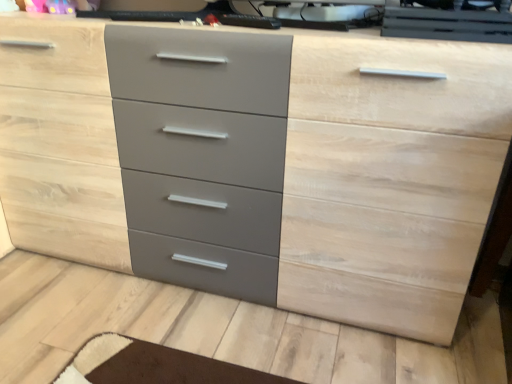
Describe the element at coordinates (446, 24) in the screenshot. The image size is (512, 384). I see `glossy black desktop computer at upper center, which is counted as the second desktop computer, starting from the left` at that location.

Measure the distance between glossy black desktop computer at upper center, the 1th desktop computer from the right, and camera.

34.69 inches.

Find the location of `glossy black desktop computer at upper center, which is counted as the second desktop computer, starting from the left`. glossy black desktop computer at upper center, which is counted as the second desktop computer, starting from the left is located at coordinates (446, 24).

What do you see at coordinates (325, 15) in the screenshot? This screenshot has width=512, height=384. I see `matte black desktop computer at upper center, the 1th desktop computer from the left` at bounding box center [325, 15].

Locate an element on the screen. Image resolution: width=512 pixels, height=384 pixels. matte black desktop computer at upper center, which is counted as the second desktop computer, starting from the right is located at coordinates (325, 15).

Where is `glossy black desktop computer at upper center, the 1th desktop computer from the right`? glossy black desktop computer at upper center, the 1th desktop computer from the right is located at coordinates (446, 24).

Is glossy black desktop computer at upper center, the 1th desktop computer from the right, to the right of matte black desktop computer at upper center, the 1th desktop computer from the left, from the viewer's perspective?

Correct, you'll find glossy black desktop computer at upper center, the 1th desktop computer from the right, to the right of matte black desktop computer at upper center, the 1th desktop computer from the left.

Is the position of glossy black desktop computer at upper center, which is counted as the second desktop computer, starting from the left, less distant than that of matte black desktop computer at upper center, which is counted as the second desktop computer, starting from the right?

Yes, glossy black desktop computer at upper center, which is counted as the second desktop computer, starting from the left, is closer to the camera.

Does point (386, 24) lie behind point (306, 19)?

No.

From the image's perspective, is glossy black desktop computer at upper center, the 1th desktop computer from the right, below matte black desktop computer at upper center, the 1th desktop computer from the left?

Yes, from the image's perspective, glossy black desktop computer at upper center, the 1th desktop computer from the right, is below matte black desktop computer at upper center, the 1th desktop computer from the left.

From a real-world perspective, is glossy black desktop computer at upper center, the 1th desktop computer from the right, under matte black desktop computer at upper center, which is counted as the second desktop computer, starting from the right?

Incorrect, from a real-world perspective, glossy black desktop computer at upper center, the 1th desktop computer from the right, is higher than matte black desktop computer at upper center, which is counted as the second desktop computer, starting from the right.

Can you confirm if glossy black desktop computer at upper center, which is counted as the second desktop computer, starting from the left, is wider than matte black desktop computer at upper center, which is counted as the second desktop computer, starting from the right?

Yes.

Considering the sizes of objects glossy black desktop computer at upper center, the 1th desktop computer from the right, and matte black desktop computer at upper center, which is counted as the second desktop computer, starting from the right, in the image provided, who is shorter, glossy black desktop computer at upper center, the 1th desktop computer from the right, or matte black desktop computer at upper center, which is counted as the second desktop computer, starting from the right,?

With less height is matte black desktop computer at upper center, which is counted as the second desktop computer, starting from the right.

From the picture: Which of these two, glossy black desktop computer at upper center, which is counted as the second desktop computer, starting from the left, or matte black desktop computer at upper center, which is counted as the second desktop computer, starting from the right, is smaller?

matte black desktop computer at upper center, which is counted as the second desktop computer, starting from the right, is smaller.

Is matte black desktop computer at upper center, which is counted as the second desktop computer, starting from the right, located within glossy black desktop computer at upper center, which is counted as the second desktop computer, starting from the left?

No, matte black desktop computer at upper center, which is counted as the second desktop computer, starting from the right, is not a part of glossy black desktop computer at upper center, which is counted as the second desktop computer, starting from the left.

Are glossy black desktop computer at upper center, the 1th desktop computer from the right, and matte black desktop computer at upper center, the 1th desktop computer from the left, far apart?

No, glossy black desktop computer at upper center, the 1th desktop computer from the right, is not far away from matte black desktop computer at upper center, the 1th desktop computer from the left.

Is glossy black desktop computer at upper center, the 1th desktop computer from the right, looking in the opposite direction of matte black desktop computer at upper center, which is counted as the second desktop computer, starting from the right?

glossy black desktop computer at upper center, the 1th desktop computer from the right, does not have its back to matte black desktop computer at upper center, which is counted as the second desktop computer, starting from the right.

Measure the distance from glossy black desktop computer at upper center, which is counted as the second desktop computer, starting from the left, to matte black desktop computer at upper center, which is counted as the second desktop computer, starting from the right.

They are 5.85 inches apart.

Locate an element on the screen. The width and height of the screenshot is (512, 384). desktop computer in front of the matte black desktop computer at upper center, which is counted as the second desktop computer, starting from the right is located at coordinates (446, 24).

Considering the positions of objects matte black desktop computer at upper center, the 1th desktop computer from the left, and glossy black desktop computer at upper center, the 1th desktop computer from the right, in the image provided, who is more to the right, matte black desktop computer at upper center, the 1th desktop computer from the left, or glossy black desktop computer at upper center, the 1th desktop computer from the right,?

From the viewer's perspective, glossy black desktop computer at upper center, the 1th desktop computer from the right, appears more on the right side.

In the image, is matte black desktop computer at upper center, the 1th desktop computer from the left, positioned in front of or behind glossy black desktop computer at upper center, the 1th desktop computer from the right?

Clearly, matte black desktop computer at upper center, the 1th desktop computer from the left, is behind glossy black desktop computer at upper center, the 1th desktop computer from the right.

Which point is more distant from viewer, [289,25] or [461,22]?

Positioned behind is point [289,25].

From the image's perspective, would you say matte black desktop computer at upper center, the 1th desktop computer from the left, is shown under glossy black desktop computer at upper center, the 1th desktop computer from the right?

No, from the image's perspective, matte black desktop computer at upper center, the 1th desktop computer from the left, is not below glossy black desktop computer at upper center, the 1th desktop computer from the right.

From a real-world perspective, is matte black desktop computer at upper center, the 1th desktop computer from the left, physically below glossy black desktop computer at upper center, which is counted as the second desktop computer, starting from the left?

Yes, from a real-world perspective, matte black desktop computer at upper center, the 1th desktop computer from the left, is under glossy black desktop computer at upper center, which is counted as the second desktop computer, starting from the left.

Looking at this image, in terms of width, does matte black desktop computer at upper center, the 1th desktop computer from the left, look wider or thinner when compared to glossy black desktop computer at upper center, the 1th desktop computer from the right?

Considering their sizes, matte black desktop computer at upper center, the 1th desktop computer from the left, looks slimmer than glossy black desktop computer at upper center, the 1th desktop computer from the right.

Considering the sizes of objects matte black desktop computer at upper center, which is counted as the second desktop computer, starting from the right, and glossy black desktop computer at upper center, which is counted as the second desktop computer, starting from the left, in the image provided, who is taller, matte black desktop computer at upper center, which is counted as the second desktop computer, starting from the right, or glossy black desktop computer at upper center, which is counted as the second desktop computer, starting from the left,?

glossy black desktop computer at upper center, which is counted as the second desktop computer, starting from the left, is taller.

Considering the relative sizes of matte black desktop computer at upper center, which is counted as the second desktop computer, starting from the right, and glossy black desktop computer at upper center, the 1th desktop computer from the right, in the image provided, is matte black desktop computer at upper center, which is counted as the second desktop computer, starting from the right, smaller than glossy black desktop computer at upper center, the 1th desktop computer from the right,?

Yes.

Is matte black desktop computer at upper center, the 1th desktop computer from the left, located outside glossy black desktop computer at upper center, which is counted as the second desktop computer, starting from the left?

Yes, matte black desktop computer at upper center, the 1th desktop computer from the left, is not within glossy black desktop computer at upper center, which is counted as the second desktop computer, starting from the left.

Is matte black desktop computer at upper center, the 1th desktop computer from the left, not near glossy black desktop computer at upper center, which is counted as the second desktop computer, starting from the left?

No, matte black desktop computer at upper center, the 1th desktop computer from the left, is in close proximity to glossy black desktop computer at upper center, which is counted as the second desktop computer, starting from the left.

Is matte black desktop computer at upper center, which is counted as the second desktop computer, starting from the right, facing away from glossy black desktop computer at upper center, which is counted as the second desktop computer, starting from the left?

No, matte black desktop computer at upper center, which is counted as the second desktop computer, starting from the right, is not facing away from glossy black desktop computer at upper center, which is counted as the second desktop computer, starting from the left.

Where is `desktop computer on the right of matte black desktop computer at upper center, the 1th desktop computer from the left`? The image size is (512, 384). desktop computer on the right of matte black desktop computer at upper center, the 1th desktop computer from the left is located at coordinates (446, 24).

This screenshot has height=384, width=512. I want to click on desktop computer in front of the matte black desktop computer at upper center, which is counted as the second desktop computer, starting from the right, so click(446, 24).

Find the location of a particular element. The width and height of the screenshot is (512, 384). desktop computer located underneath the glossy black desktop computer at upper center, the 1th desktop computer from the right (from a real-world perspective) is located at coordinates (325, 15).